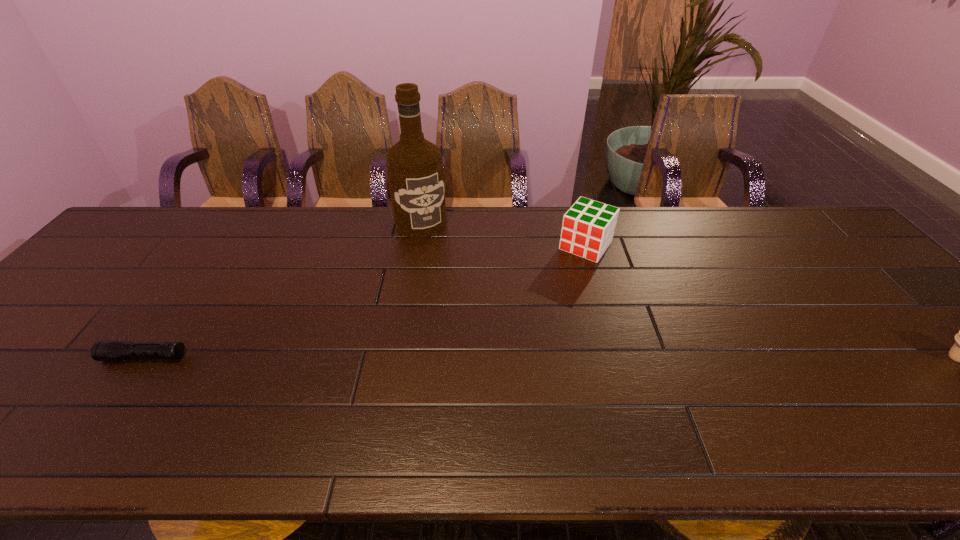
Where is `vacant space at the far left corner of the desktop`? This screenshot has width=960, height=540. vacant space at the far left corner of the desktop is located at coordinates (113, 250).

In the image, there is a desktop. At what (x,y) coordinates should I click in order to perform the action: click on free region at the far right corner. Please return your answer as a coordinate pair (x, y). The height and width of the screenshot is (540, 960). Looking at the image, I should click on (808, 227).

You are a GUI agent. You are given a task and a screenshot of the screen. Output one action in this format:
    pyautogui.click(x=<x>, y=<y>)
    Task: Click on the empty space between the second object from left to right and the flashlight
    The image size is (960, 540).
    Given the screenshot: What is the action you would take?
    pyautogui.click(x=283, y=290)

Identify the location of blank region between the third object from right to left and the second object from right to left. (503, 234).

At what (x,y) coordinates should I click in order to perform the action: click on unoccupied position between the leftmost object and the tallest object. Please return your answer as a coordinate pair (x, y). The image size is (960, 540). Looking at the image, I should click on (283, 290).

You are a GUI agent. You are given a task and a screenshot of the screen. Output one action in this format:
    pyautogui.click(x=<x>, y=<y>)
    Task: Click on the unoccupied position between the flashlight and the third tallest object
    The width and height of the screenshot is (960, 540).
    Given the screenshot: What is the action you would take?
    pyautogui.click(x=365, y=301)

Locate an element on the screen. This screenshot has width=960, height=540. free space between the tallest object and the leftmost object is located at coordinates (283, 290).

The image size is (960, 540). In order to click on free spot between the second object from left to right and the second object from right to left in this screenshot , I will do `click(503, 234)`.

Locate an element on the screen. unoccupied position between the cube and the leftmost object is located at coordinates (365, 301).

Locate which object ranks third in proximity to the icecream. Please provide its 2D coordinates. Your answer should be formatted as a tuple, i.e. [(x, y)], where the tuple contains the x and y coordinates of a point satisfying the conditions above.

[(101, 350)]